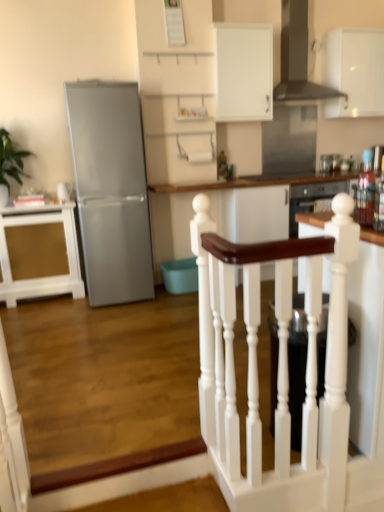
The width and height of the screenshot is (384, 512). Identify the location of free space on the front side of satin silver refrigerator at left. (105, 316).